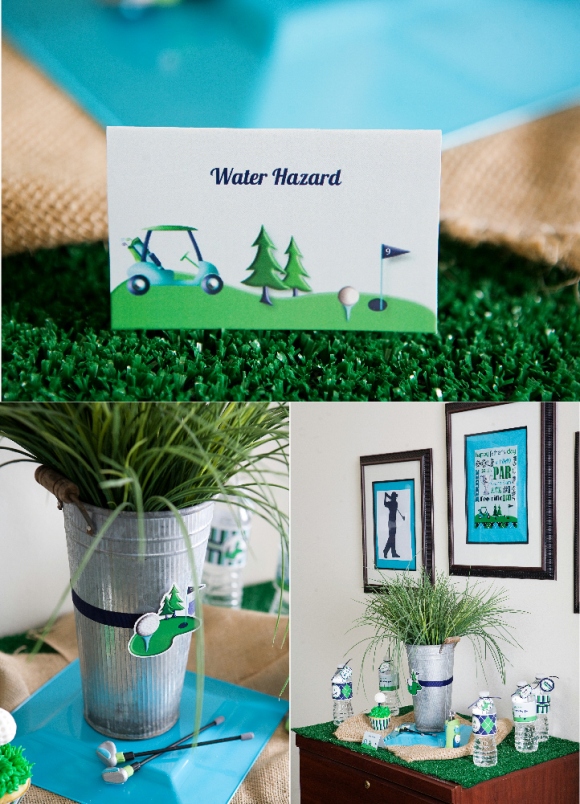
The image size is (580, 804). I want to click on blue plate, so click(x=209, y=776), click(x=423, y=743), click(x=322, y=81).